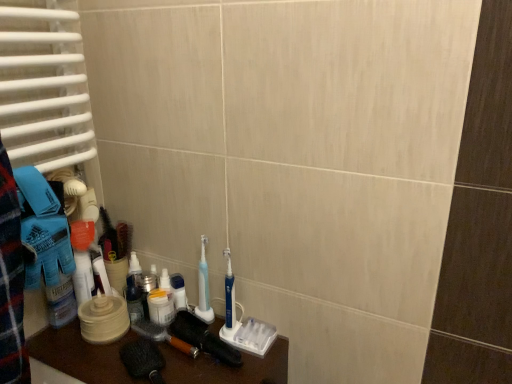
Find the location of a particular element. The height and width of the screenshot is (384, 512). vacant space to the left of dark brown wooden brush at lower left, which appears as the second brush when viewed from the right is located at coordinates (83, 356).